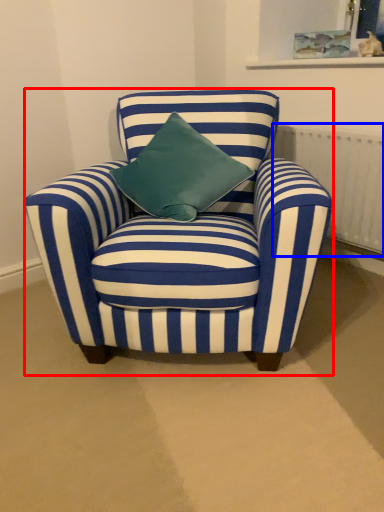
Question: Which object is further to the camera taking this photo, chair (highlighted by a red box) or radiator (highlighted by a blue box)?

Choices:
 (A) chair
 (B) radiator

Answer: (B)